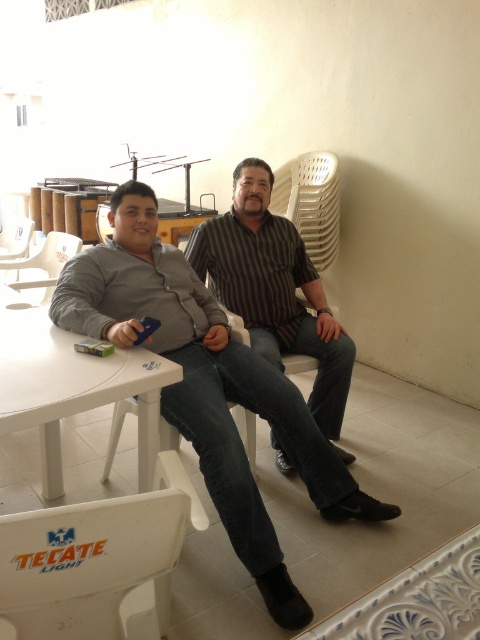
You are standing at the origin point of this coordinate system where the white plastic table is located. The coordinates given are in normalized image coordinates. There is a point marked at (41, 268). What object does this point correspond to?

The point at (41, 268) corresponds to the white plastic chair at upper left.

You are sitting at the white plastic table and want to move to the white plastic chair at lower left. Which direction should you move relative to the white plastic chair at left?

The white plastic chair at lower left is positioned on the right side of the white plastic chair at left, so you should move to the right relative to the white plastic chair at left.